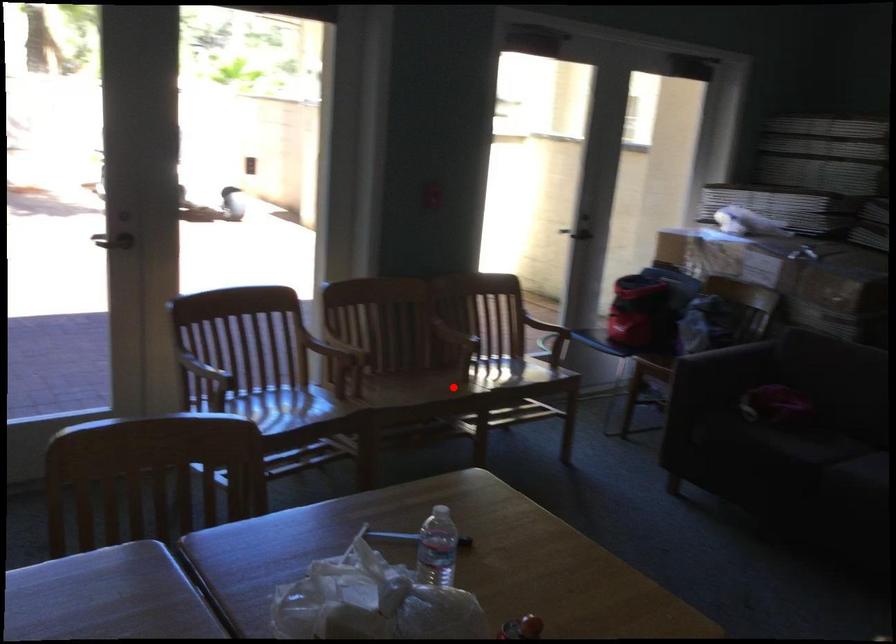
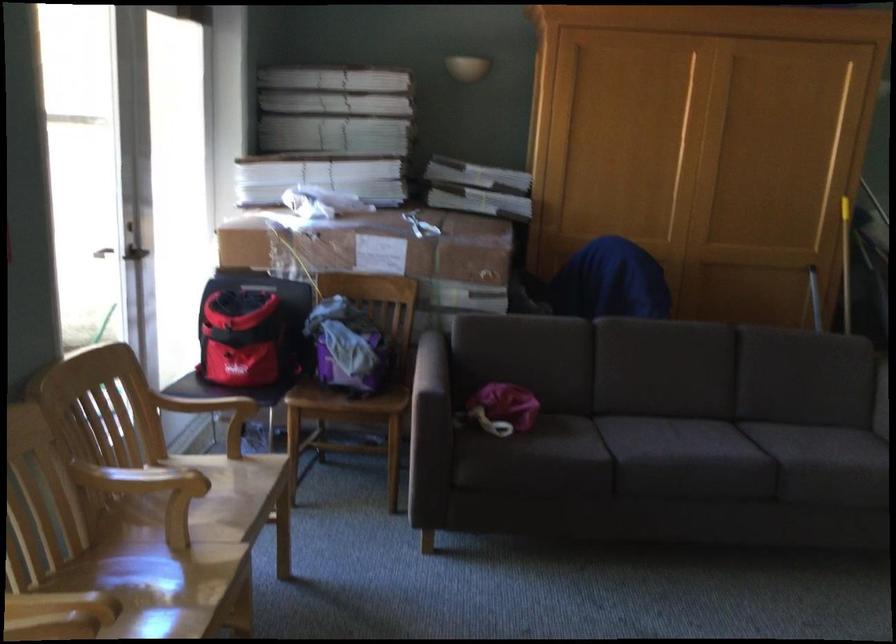
The point at the highlighted location is marked in the first image. Where is the corresponding point in the second image?

(169, 590)